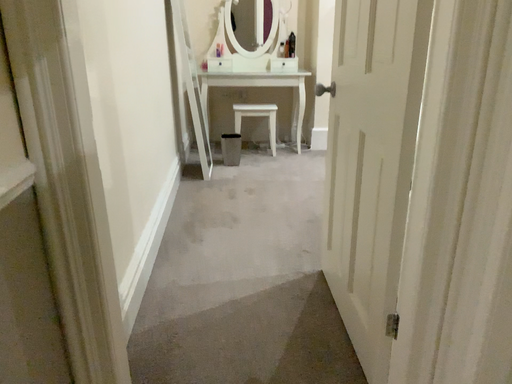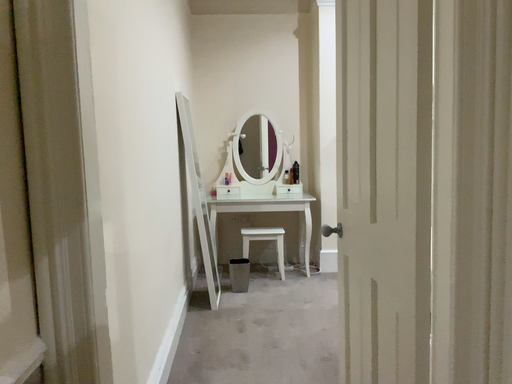
Question: How did the camera likely rotate when shooting the video?

Choices:
 (A) rotated upward
 (B) rotated downward

Answer: (A)